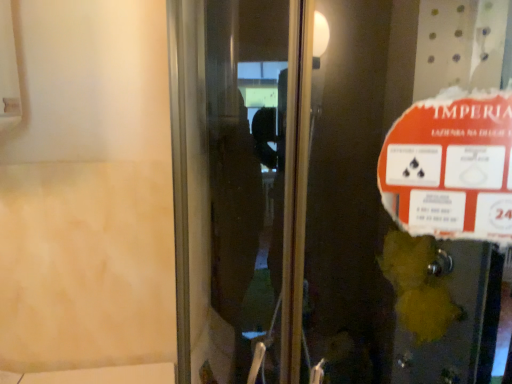
Question: Considering their positions, is transparent glass elevator door at center located in front of or behind orange paper sign at upper right?

Choices:
 (A) behind
 (B) front

Answer: (B)

Question: From a real-world perspective, is transparent glass elevator door at center above or below orange paper sign at upper right?

Choices:
 (A) below
 (B) above

Answer: (A)

Question: Is transparent glass elevator door at center taller or shorter than orange paper sign at upper right?

Choices:
 (A) short
 (B) tall

Answer: (B)

Question: Would you say orange paper sign at upper right is inside or outside transparent glass elevator door at center?

Choices:
 (A) outside
 (B) inside

Answer: (B)

Question: Considering their positions, is orange paper sign at upper right located in front of or behind transparent glass elevator door at center?

Choices:
 (A) front
 (B) behind

Answer: (B)

Question: Is orange paper sign at upper right taller or shorter than transparent glass elevator door at center?

Choices:
 (A) tall
 (B) short

Answer: (B)

Question: Is point click(x=464, y=190) positioned closer to the camera than point click(x=356, y=297)?

Choices:
 (A) closer
 (B) farther

Answer: (A)